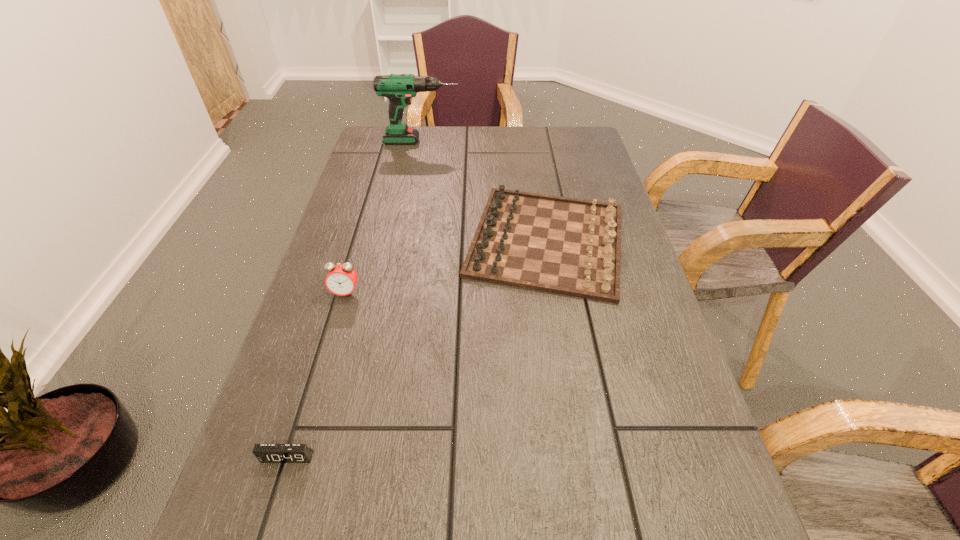
Where is `object that is at the far edge`? The image size is (960, 540). object that is at the far edge is located at coordinates (398, 88).

I want to click on drill at the left edge, so click(398, 88).

Where is `object at the right edge`? This screenshot has width=960, height=540. object at the right edge is located at coordinates (567, 246).

This screenshot has height=540, width=960. Identify the location of object that is at the far left corner. (398, 88).

Identify the location of vacant space at the far edge of the desktop. (537, 142).

The width and height of the screenshot is (960, 540). I want to click on vacant area at the left edge, so click(x=365, y=255).

Find the location of `free space at the right edge of the desktop`. free space at the right edge of the desktop is located at coordinates (685, 519).

Find the location of a particular element. free location at the far left corner of the desktop is located at coordinates (382, 144).

The width and height of the screenshot is (960, 540). In order to click on free space at the far right corner of the desktop in this screenshot , I will do [x=564, y=147].

Identify the location of vacant area between the rightmost object and the farther alarm clock. The width and height of the screenshot is (960, 540). (446, 267).